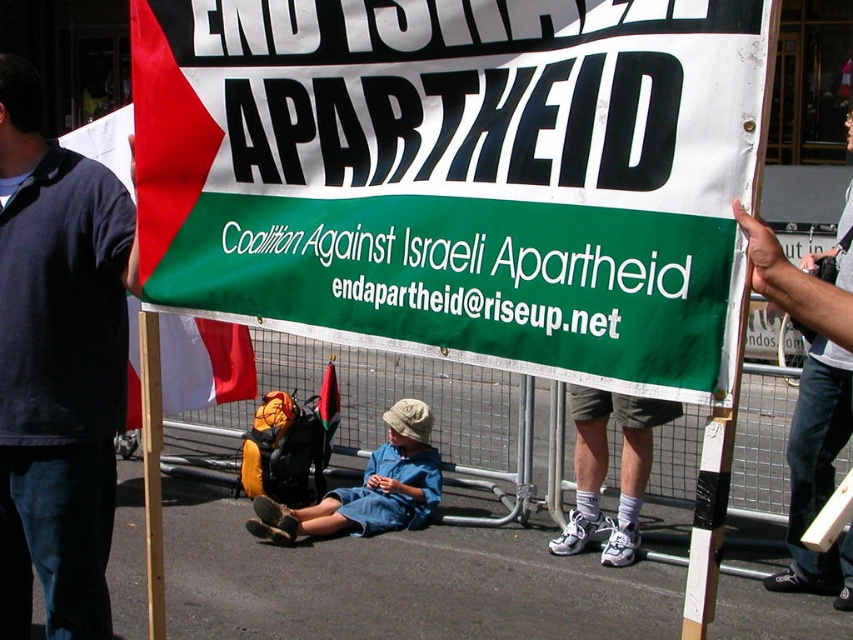
You are a photographer trying to capture a clear shot of the banner and the child in the protest scene. You notice two points marked in the image. Which point is closer to you, point at coordinates (519, 355) or point at coordinates (268, 532)?

Point at coordinates (519, 355) is closer to the viewer than point at coordinates (268, 532).

You are a photographer at the protest scene. You want to capture a photo that includes both the white paper banner at center and the blue denim shorts at center. Based on their sizes, which object should appear larger in the photo?

The white paper banner at center is taller than blue denim shorts at center, so it should appear larger in the photo.

You are a photographer positioned at the scene of the protest. You want to capture a closeup shot of the banner while also including the blue denim shorts at center in the frame. Given your current position, is it possible to do so without moving your camera?

The blue denim shorts at center are 4.72 meters away from the viewer. Since the banner is being held by individuals in front of the shorts, the distance might allow capturing both in a single frame depending on the lens focal length. However, without moving the camera position, it may be challenging due to the banner being closer, potentially blocking the shorts. Further details on camera equipment aren